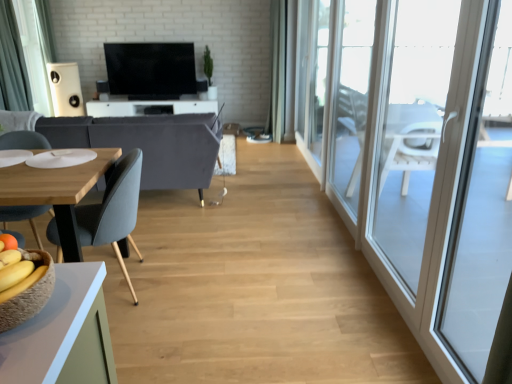
Question: Does flat screen tv at center have a lesser height compared to dark gray fabric curtain at left?

Choices:
 (A) no
 (B) yes

Answer: (B)

Question: Would you consider flat screen tv at center to be distant from dark gray fabric curtain at left?

Choices:
 (A) yes
 (B) no

Answer: (A)

Question: From the image's perspective, is flat screen tv at center on top of dark gray fabric curtain at left?

Choices:
 (A) yes
 (B) no

Answer: (A)

Question: From a real-world perspective, is flat screen tv at center located beneath dark gray fabric curtain at left?

Choices:
 (A) yes
 (B) no

Answer: (A)

Question: Considering the relative sizes of flat screen tv at center and dark gray fabric curtain at left in the image provided, is flat screen tv at center taller than dark gray fabric curtain at left?

Choices:
 (A) yes
 (B) no

Answer: (B)

Question: Is white glossy tv stand at center, acting as the 1th table starting from the back, wider or thinner than transparent glass door at right, arranged as the 1th window when viewed from the front?

Choices:
 (A) wide
 (B) thin

Answer: (A)

Question: From the image's perspective, is white glossy tv stand at center, acting as the second table starting from the front, positioned above or below transparent glass door at right, which appears as the third window when viewed from the back?

Choices:
 (A) below
 (B) above

Answer: (B)

Question: Visually, is white glossy tv stand at center, the second table positioned from the bottom, positioned to the left or to the right of transparent glass door at right, arranged as the 1th window when viewed from the front?

Choices:
 (A) left
 (B) right

Answer: (A)

Question: Is point (122, 99) closer or farther from the camera than point (381, 152)?

Choices:
 (A) closer
 (B) farther

Answer: (B)

Question: Considering the positions of point (18, 286) and point (352, 173), is point (18, 286) closer or farther from the camera than point (352, 173)?

Choices:
 (A) closer
 (B) farther

Answer: (A)

Question: Is yellow matte bananas at lower left wider or thinner than transparent glass door at right, which is the second window from back to front?

Choices:
 (A) thin
 (B) wide

Answer: (B)

Question: From the image's perspective, is yellow matte bananas at lower left above or below transparent glass door at right, the second window in the front-to-back sequence?

Choices:
 (A) above
 (B) below

Answer: (B)

Question: From a real-world perspective, relative to transparent glass door at right, which is the second window from back to front, is yellow matte bananas at lower left vertically above or below?

Choices:
 (A) above
 (B) below

Answer: (A)

Question: Visually, is flat screen tv at center positioned to the left or to the right of dark gray fabric curtain at left?

Choices:
 (A) left
 (B) right

Answer: (B)

Question: Looking at their shapes, would you say flat screen tv at center is wider or thinner than dark gray fabric curtain at left?

Choices:
 (A) wide
 (B) thin

Answer: (B)